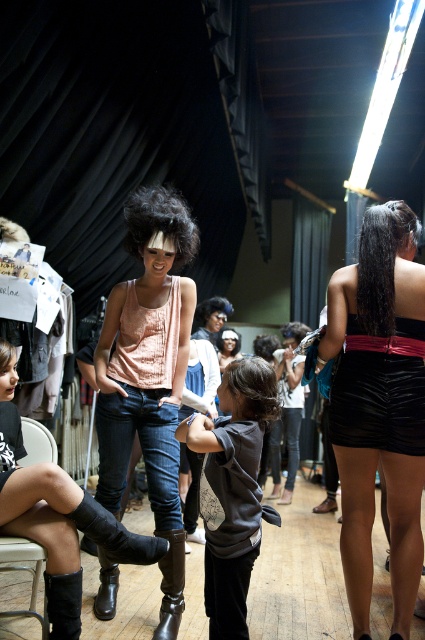
Does shiny black dress at center have a lesser width compared to matte peach tank top at center?

Correct, shiny black dress at center's width is less than matte peach tank top at center's.

Can you confirm if shiny black dress at center is smaller than matte peach tank top at center?

Correct, shiny black dress at center occupies less space than matte peach tank top at center.

Locate an element on the screen. Image resolution: width=425 pixels, height=640 pixels. shiny black dress at center is located at coordinates (379, 404).

Find the location of a particular element. shiny black dress at center is located at coordinates (379, 404).

Locate an element on the screen. shiny black dress at center is located at coordinates (379, 404).

Is shiny black dress at center to the left of dark gray sweatshirt at center from the viewer's perspective?

In fact, shiny black dress at center is to the right of dark gray sweatshirt at center.

Image resolution: width=425 pixels, height=640 pixels. I want to click on shiny black dress at center, so click(x=379, y=404).

Can you confirm if brown leather cowboy boot at lower center is shorter than black leather cowboy boot at lower left?

In fact, brown leather cowboy boot at lower center may be taller than black leather cowboy boot at lower left.

Looking at this image, who is higher up, brown leather cowboy boot at lower center or black leather cowboy boot at lower left?

black leather cowboy boot at lower left is above.

Does point (181, 582) lie in front of point (70, 589)?

No, it is behind (70, 589).

Where is `brown leather cowboy boot at lower center`? The width and height of the screenshot is (425, 640). brown leather cowboy boot at lower center is located at coordinates (170, 584).